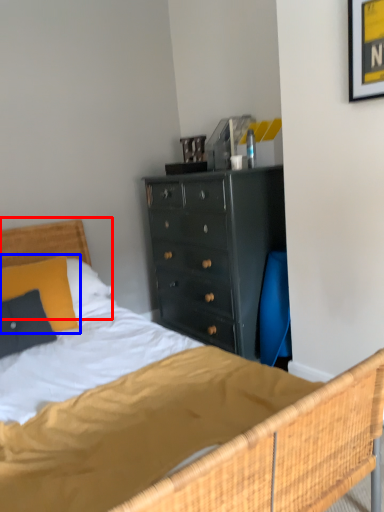
Question: Which point is closer to the camera, headboard (highlighted by a red box) or pillow (highlighted by a blue box)?

Choices:
 (A) headboard
 (B) pillow

Answer: (B)